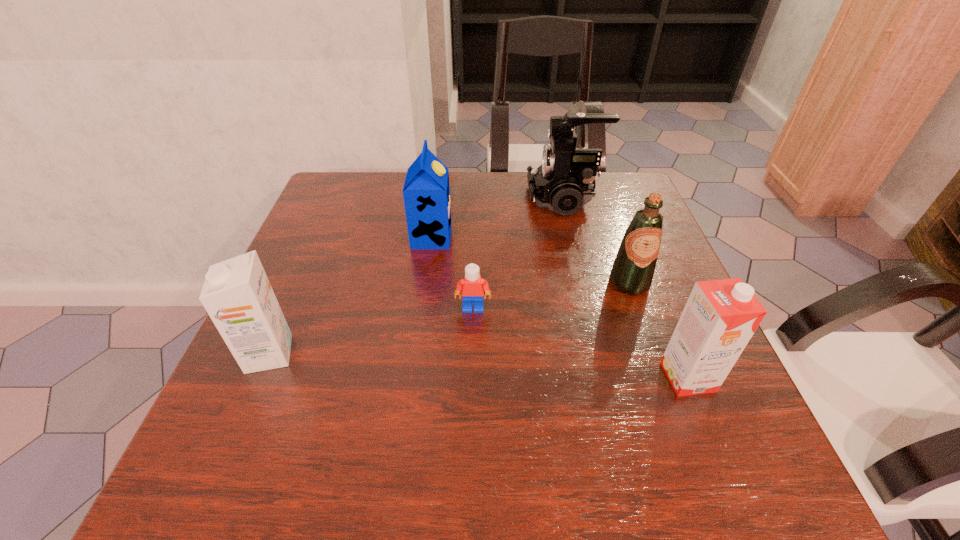
Identify the location of carton positioned at the right edge. (720, 317).

Find the location of a particular element. object that is positioned at the far right corner is located at coordinates (564, 182).

At what (x,y) coordinates should I click in order to perform the action: click on free region at the far edge. Please return your answer as a coordinate pair (x, y). Looking at the image, I should click on (400, 191).

This screenshot has height=540, width=960. In the image, there is a desktop. Find the location of `vacant space at the near edge`. vacant space at the near edge is located at coordinates (614, 458).

Image resolution: width=960 pixels, height=540 pixels. Find the location of `vacant area at the left edge of the desktop`. vacant area at the left edge of the desktop is located at coordinates (347, 301).

At what (x,y) coordinates should I click in order to perform the action: click on vacant position at the right edge of the desktop. Please return your answer as a coordinate pair (x, y). Looking at the image, I should click on (680, 314).

Find the location of a particular element. The height and width of the screenshot is (540, 960). vacant space at the far left corner of the desktop is located at coordinates (369, 174).

This screenshot has height=540, width=960. I want to click on blank space at the far right corner of the desktop, so click(587, 211).

I want to click on vacant space at the near right corner, so click(710, 458).

The image size is (960, 540). Identify the location of free space between the camcorder and the third object from left to right. (518, 254).